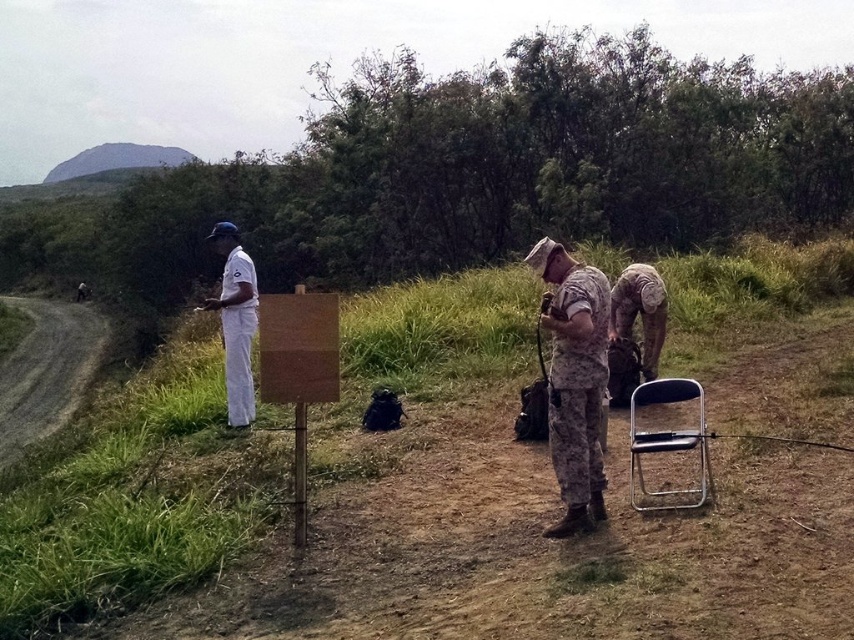
You are a photographer positioned at the scene. You want to capture a photo that includes both the camouflage fabric uniform at center and the metallic silver folding chair at lower right. Which object should you focus on first to ensure both are in frame?

The camouflage fabric uniform at center is in front of the metallic silver folding chair at lower right, so you should focus on the camouflage fabric uniform at center first to ensure both are in frame.

You are a photographer trying to capture a group photo of the camouflage fabric uniform at center and the metallic silver folding chair at lower right. If you want to ensure both subjects are fully visible in the frame, which subject should you position closer to the camera to avoid cropping?

The camouflage fabric uniform at center has a smaller width than the metallic silver folding chair at lower right. To ensure both are fully visible, position the camouflage fabric uniform at center closer to the camera since its narrower width requires less space in the frame compared to the wider metallic silver folding chair at lower right.